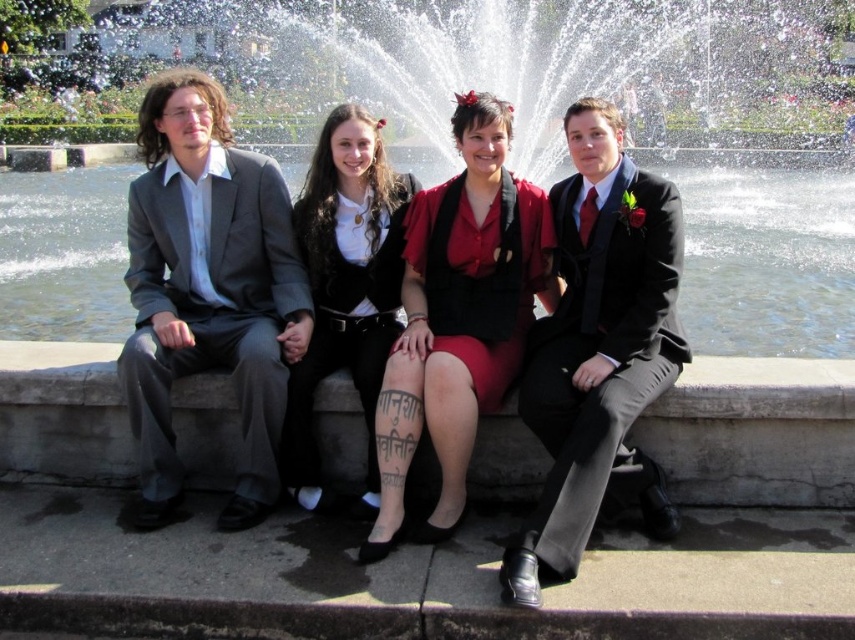
Question: Does matte gray suit at left appear on the left side of red satin dress at center?

Choices:
 (A) no
 (B) yes

Answer: (B)

Question: Can you confirm if clear glass water at center is positioned above matte red skirt at center?

Choices:
 (A) yes
 (B) no

Answer: (A)

Question: Which point is farther from the camera taking this photo?

Choices:
 (A) (711, 472)
 (B) (499, 353)
 (C) (703, 317)

Answer: (C)

Question: Which point is closer to the camera?

Choices:
 (A) matte gray suit at left
 (B) concrete ledge at center

Answer: (B)

Question: Considering the relative positions of clear glass water at center and matte gray suit at left in the image provided, where is clear glass water at center located with respect to matte gray suit at left?

Choices:
 (A) below
 (B) above

Answer: (B)

Question: Which of the following is the farthest from the observer?

Choices:
 (A) (223, 298)
 (B) (77, 468)
 (C) (467, 256)
 (D) (358, 208)

Answer: (D)